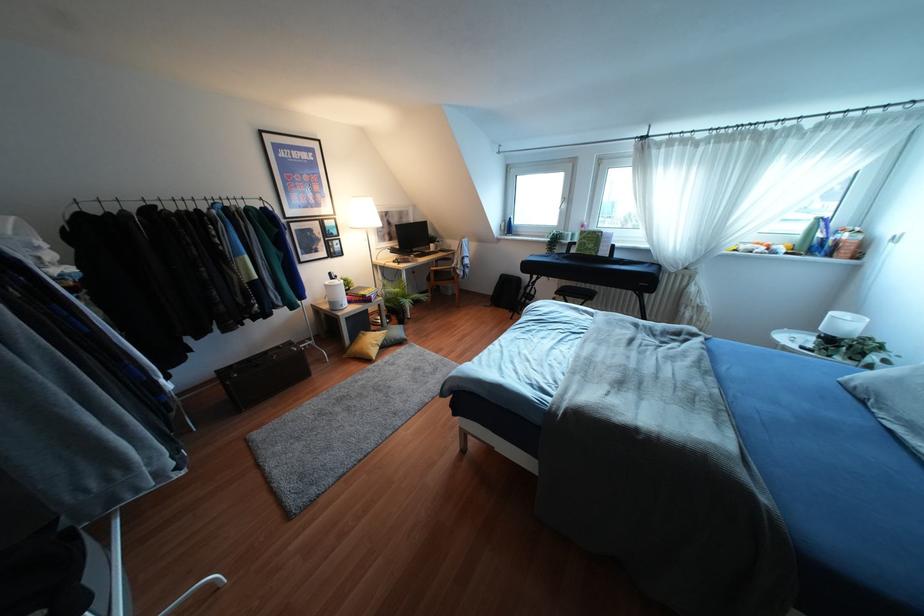
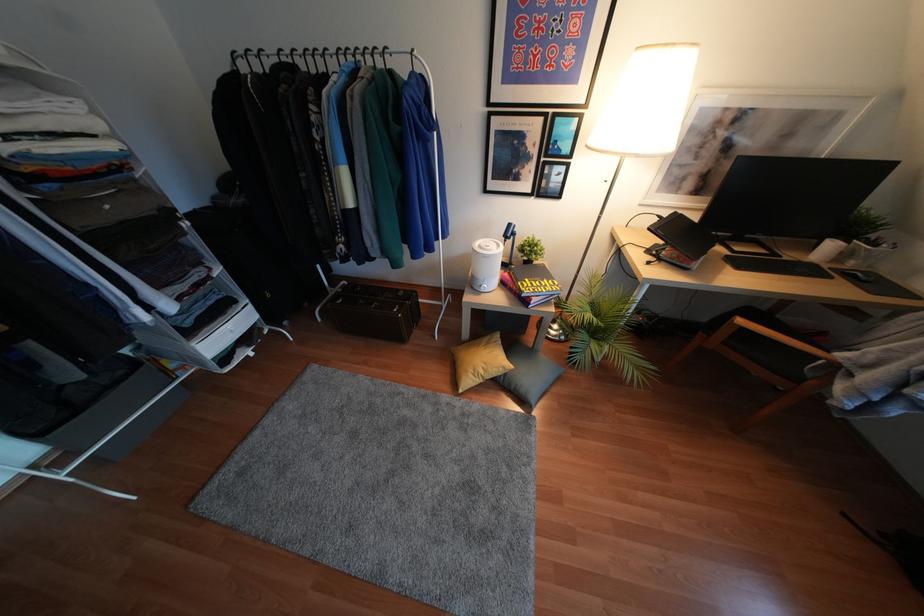
In the second image, find the point that corresponds to point (393, 249) in the first image.

(666, 224)